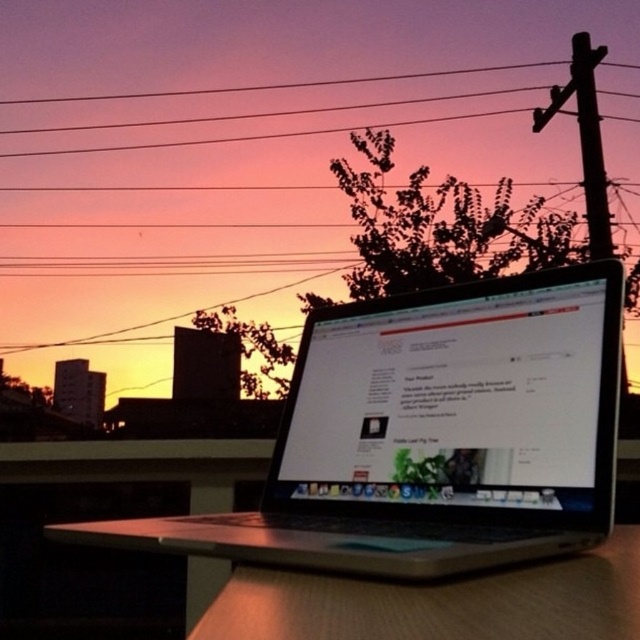
You are a delivery person who needs to place a package on the wooden surface where the silver metallic laptop at center and the satin silver laptop at center are located. Can you fit the package between them if the package is 1.5 inches wide?

The silver metallic laptop at center and the satin silver laptop at center are 1.38 inches apart. Since the package is 1.5 inches wide, which is wider than the space between them, the package cannot fit between them.

You are an interior designer planning to place both the silver metallic laptop at center and the satin silver laptop at center on a desk. Given their sizes, which one should you place first to ensure both fit properly?

The silver metallic laptop at center is bigger than the satin silver laptop at center, so you should place the silver metallic laptop at center first to ensure both fit properly.

From the picture: You are organizing a tech fair and need to display two laptops side by side on a table. The silver metallic laptop at center and the satin silver laptop at center. Given their sizes, which one would require more vertical space when placed upright?

The silver metallic laptop at center requires more vertical space when placed upright because it is much taller than the satin silver laptop at center according to the description.